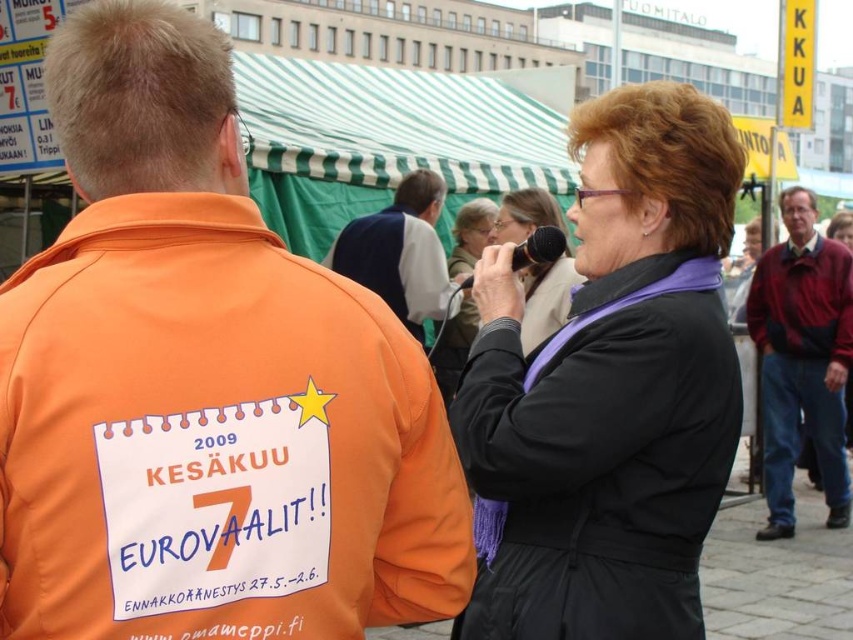
Question: Can you confirm if black fabric microphone at center is smaller than black plastic microphone at upper center?

Choices:
 (A) yes
 (B) no

Answer: (B)

Question: Which of these objects is positioned closest to the maroon sweater at upper right?

Choices:
 (A) black fabric microphone at center
 (B) dark blue vest at center
 (C) orange fabric jacket at left

Answer: (A)

Question: Which object is positioned closest to the maroon sweater at upper right?

Choices:
 (A) orange fabric jacket at left
 (B) dark blue vest at center

Answer: (B)

Question: Is black matte jacket at center closer to camera compared to maroon sweater at upper right?

Choices:
 (A) no
 (B) yes

Answer: (B)

Question: Is maroon sweater at upper right closer to camera compared to black fabric microphone at center?

Choices:
 (A) yes
 (B) no

Answer: (B)

Question: Which point is closer to the camera taking this photo?

Choices:
 (A) (225, 122)
 (B) (793, 237)

Answer: (A)